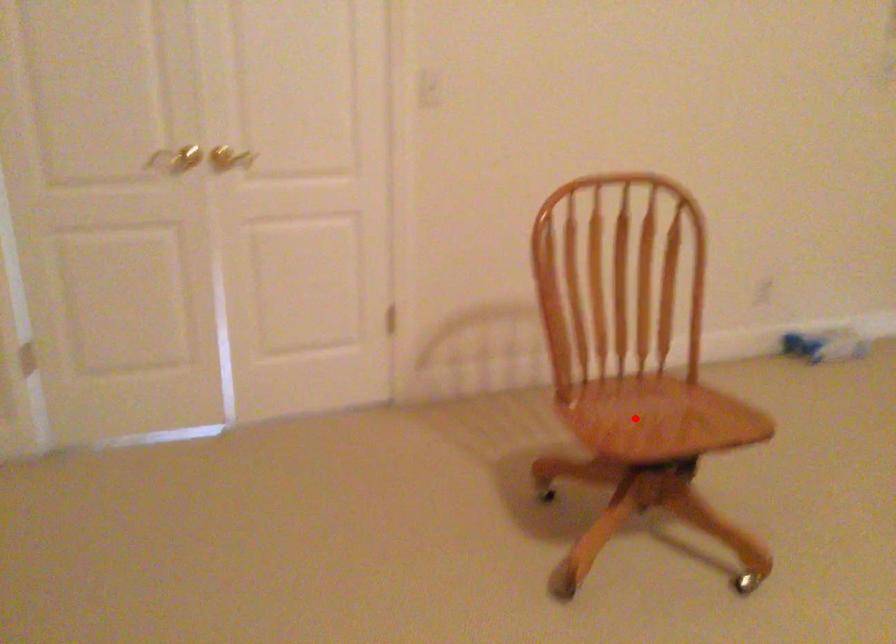
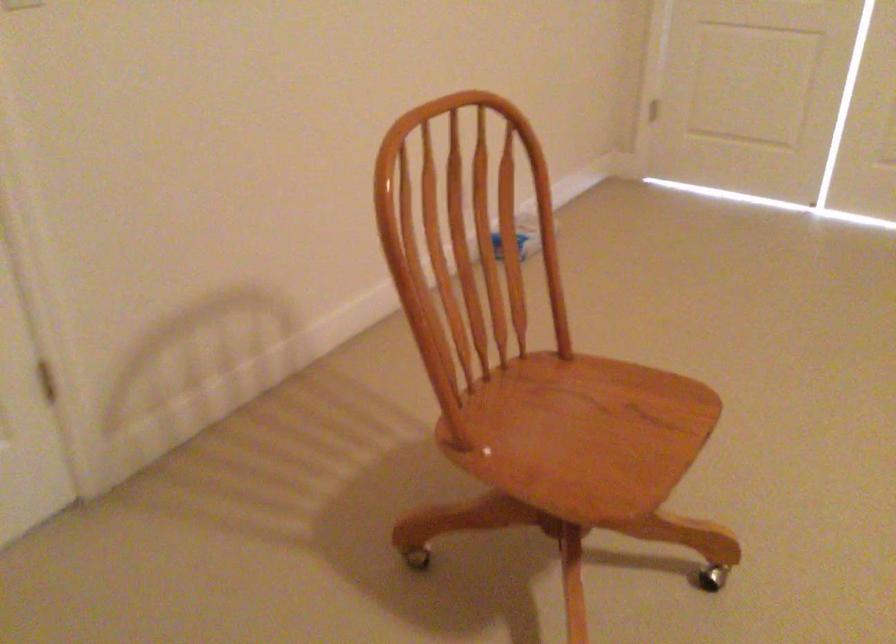
Question: I am providing you with two images of the same scene from different viewpoints. Given a red point in image1, look at the same physical point in image2. Is it:

Choices:
 (A) Closer to the viewpoint
 (B) Farther from the viewpoint

Answer: (A)